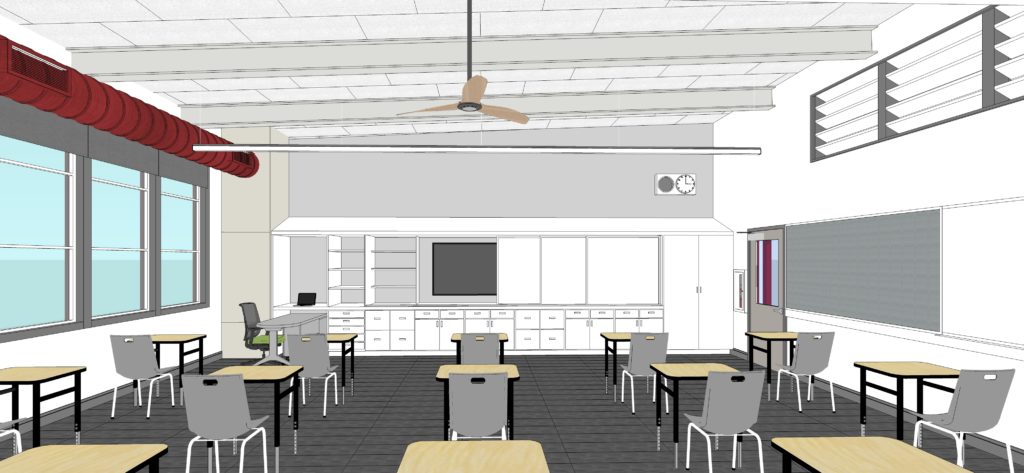
What are the coordinates of `door` in the screenshot? It's located at (768, 315), (774, 248), (759, 268).